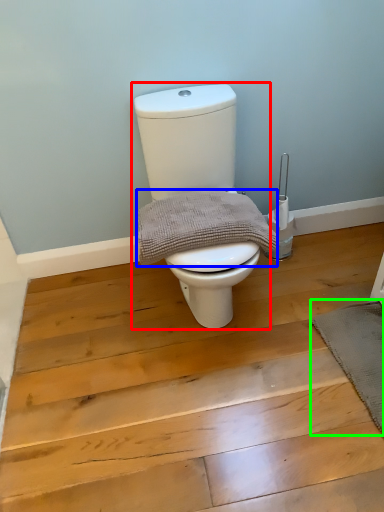
Question: Considering the real-world distances, which object is closest to toilet (highlighted by a red box)? material (highlighted by a blue box) or bath mat (highlighted by a green box).

Choices:
 (A) material
 (B) bath mat

Answer: (A)